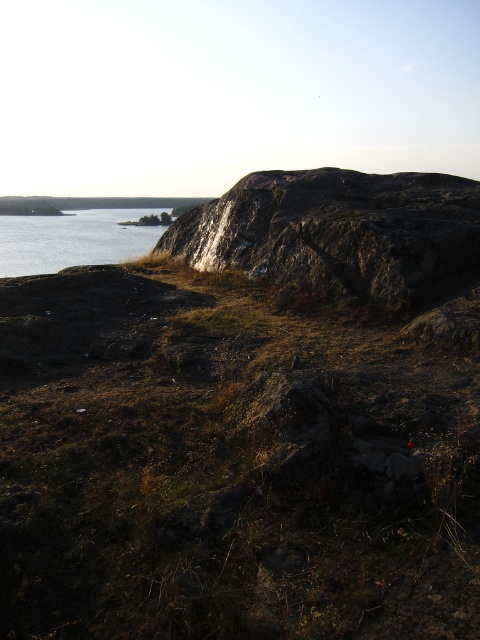
Question: Which of the following is the farthest from the observer?

Choices:
 (A) blue water at left
 (B) rough granite rock at upper right

Answer: (A)

Question: In this image, where is rough granite rock at upper right located relative to blue water at left?

Choices:
 (A) right
 (B) left

Answer: (A)

Question: Can you confirm if rough granite rock at upper right is thinner than blue water at left?

Choices:
 (A) no
 (B) yes

Answer: (B)

Question: Which of the following is the farthest from the observer?

Choices:
 (A) (408, 193)
 (B) (40, 236)

Answer: (B)

Question: Is rough granite rock at upper right to the right of blue water at left from the viewer's perspective?

Choices:
 (A) yes
 (B) no

Answer: (A)